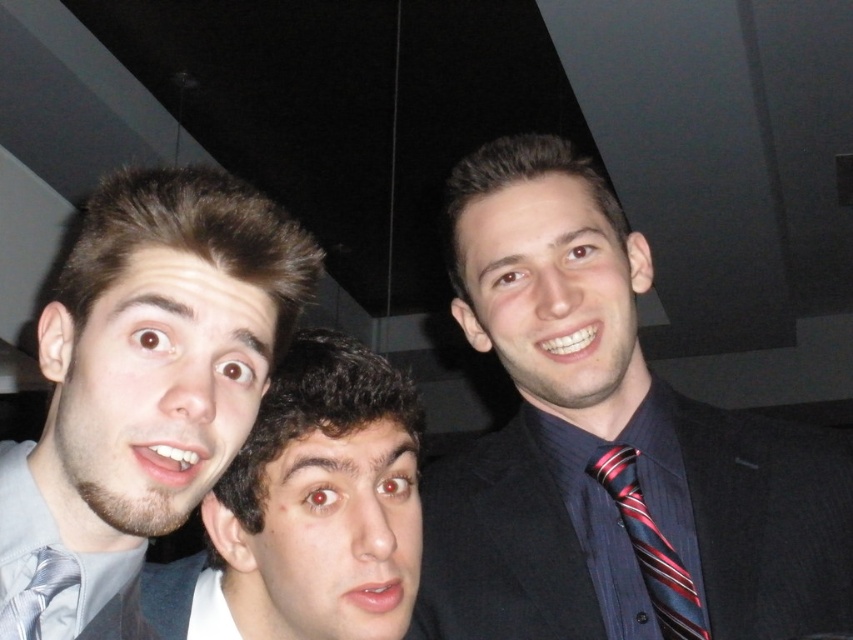
Question: Which object is farther from the camera taking this photo?

Choices:
 (A) silvery metallic tie at center
 (B) matte gray tie at left
 (C) striped silk tie at right
 (D) dark blue suit at right

Answer: (C)

Question: Does dark blue suit at right have a lesser width compared to striped silk tie at right?

Choices:
 (A) no
 (B) yes

Answer: (A)

Question: Which point is closer to the camera?

Choices:
 (A) (277, 554)
 (B) (651, 544)
 (C) (24, 620)
 (D) (535, 234)

Answer: (C)

Question: Is dark blue suit at right to the right of striped silk tie at right from the viewer's perspective?

Choices:
 (A) no
 (B) yes

Answer: (A)

Question: Among these points, which one is farthest from the camera?

Choices:
 (A) (282, 252)
 (B) (202, 616)
 (C) (596, 481)

Answer: (C)

Question: Is the position of striped silk tie at right more distant than that of silvery metallic tie at center?

Choices:
 (A) no
 (B) yes

Answer: (B)